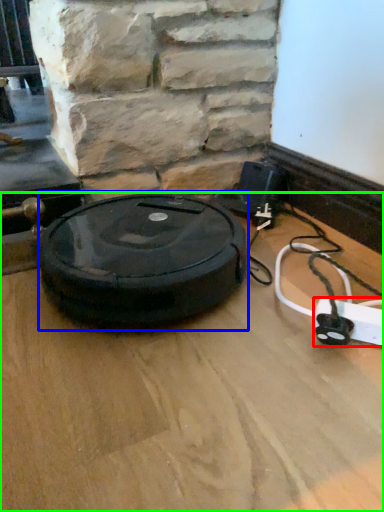
Question: Considering the real-world distances, which object is closest to extension cord (highlighted by a red box)? car tire (highlighted by a blue box) or surface (highlighted by a green box).

Choices:
 (A) car tire
 (B) surface

Answer: (B)